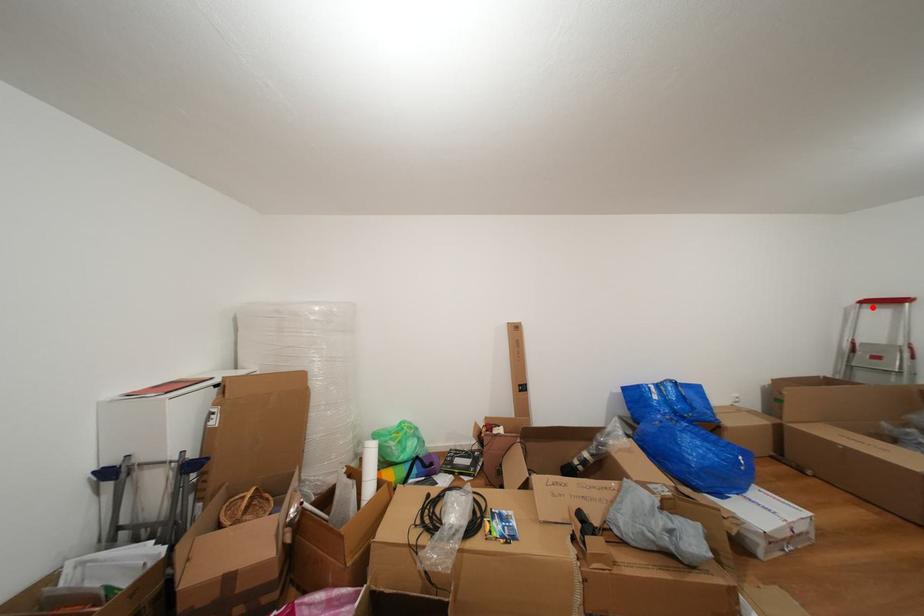
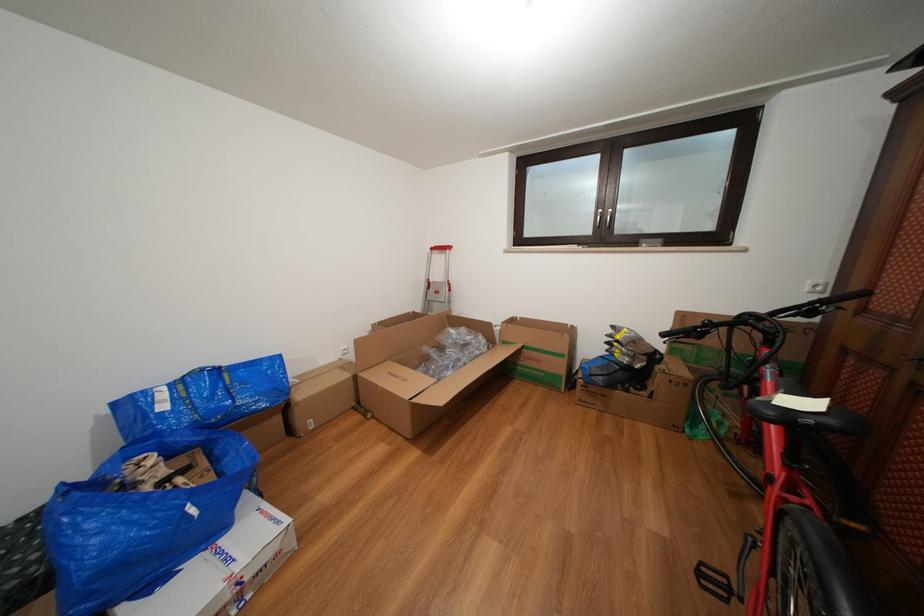
Question: A red point is marked in image1. In image2, is the corresponding 3D point closer to the camera or farther? Reply with the corresponding letter.

Choices:
 (A) The corresponding 3D point is closer.
 (B) The corresponding 3D point is farther.

Answer: (A)